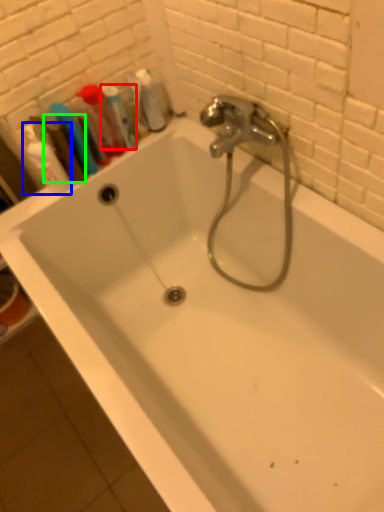
Question: Considering the real-world distances, which object is closest to mouthwash (highlighted by a red box)? shaving cream (highlighted by a blue box) or mouthwash (highlighted by a green box).

Choices:
 (A) shaving cream
 (B) mouthwash

Answer: (B)